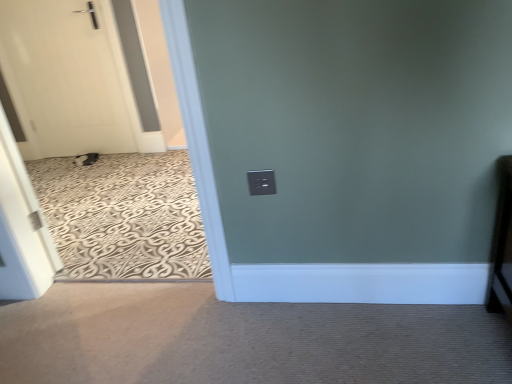
Question: From a real-world perspective, is white matte door at left above or below black plastic electric outlet at center?

Choices:
 (A) above
 (B) below

Answer: (A)

Question: Is white matte door at left inside the boundaries of black plastic electric outlet at center, or outside?

Choices:
 (A) inside
 (B) outside

Answer: (B)

Question: Relative to black plastic electric outlet at center, is white matte door at left in front or behind?

Choices:
 (A) behind
 (B) front

Answer: (A)

Question: Is black plastic electric outlet at center inside or outside of white matte door at left?

Choices:
 (A) outside
 (B) inside

Answer: (A)

Question: Is black plastic electric outlet at center in front of or behind white matte door at left in the image?

Choices:
 (A) front
 (B) behind

Answer: (A)

Question: From the image's perspective, is black plastic electric outlet at center located above or below white matte door at left?

Choices:
 (A) below
 (B) above

Answer: (A)

Question: Looking at their shapes, would you say black plastic electric outlet at center is wider or thinner than white matte door at left?

Choices:
 (A) thin
 (B) wide

Answer: (A)